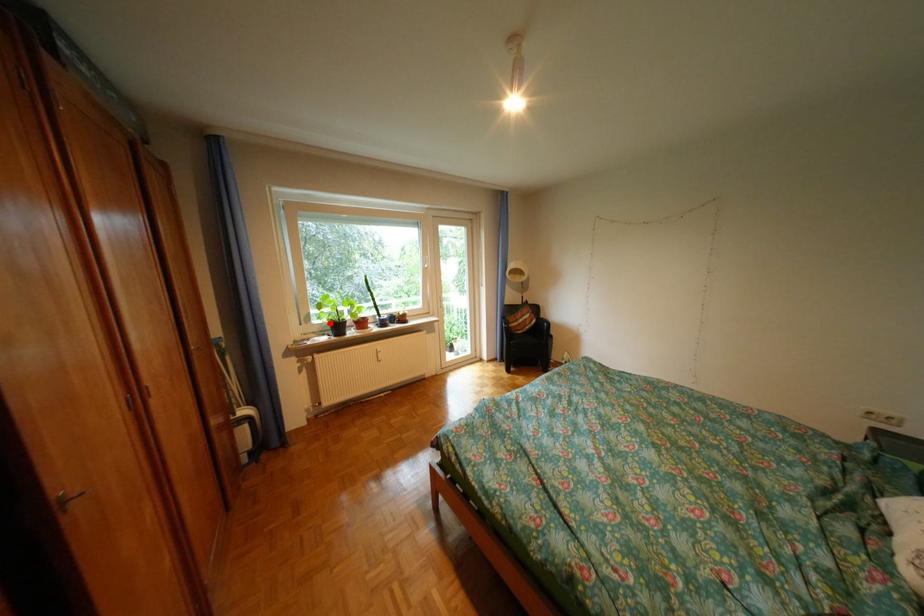
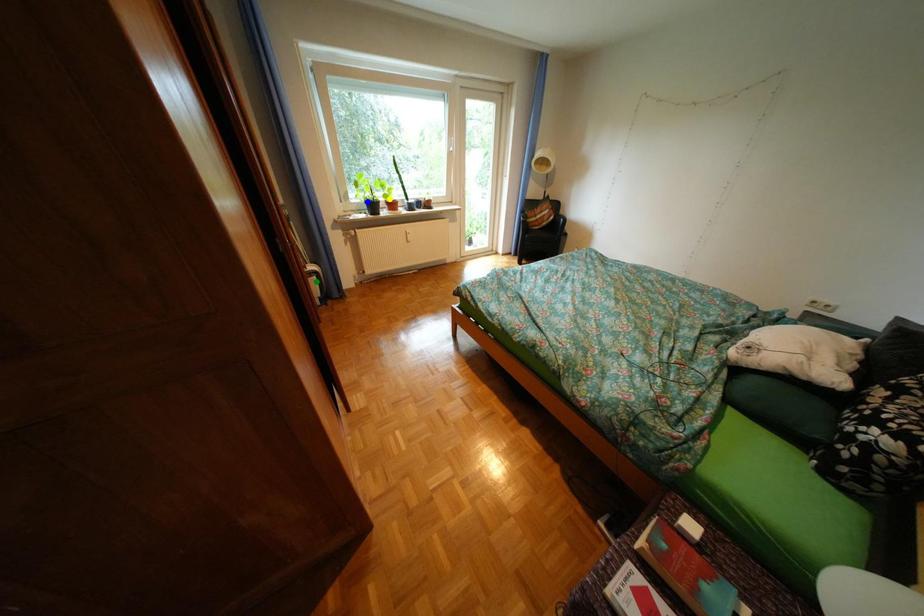
Question: I am providing you with two images of the same scene from different viewpoints. A red point is marked on the first image. You are given multiple points on the second image. Which point in image 2 represents the same 3d spot as the red point in image 1?

Choices:
 (A) blue point
 (B) yellow point
 (C) green point

Answer: (A)